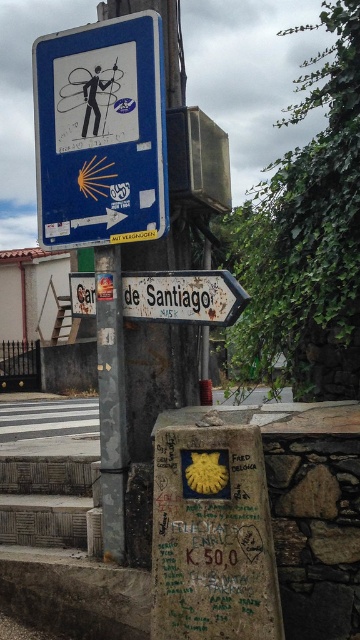
You are a hiker trying to follow the Camino de Santiago route and see the blue plastic sign at upper center and the white wooden signpost at center. Which sign should you pay attention to for direction?

The blue plastic sign at upper center is taller than the white wooden signpost at center, so it is more prominent and likely the correct one to follow for directions on the Camino de Santiago route.

You are standing at the intersection and need to follow the Camino de Santiago. There is a blue plastic sign at upper center and another sign below it. According to their positions, which sign should you look at first for directions?

The blue plastic sign at upper center is located at point 0.281 on the vertical axis, which is higher up, so you should look at the blue plastic sign at upper center first as it is positioned higher and likely provides primary directional information.